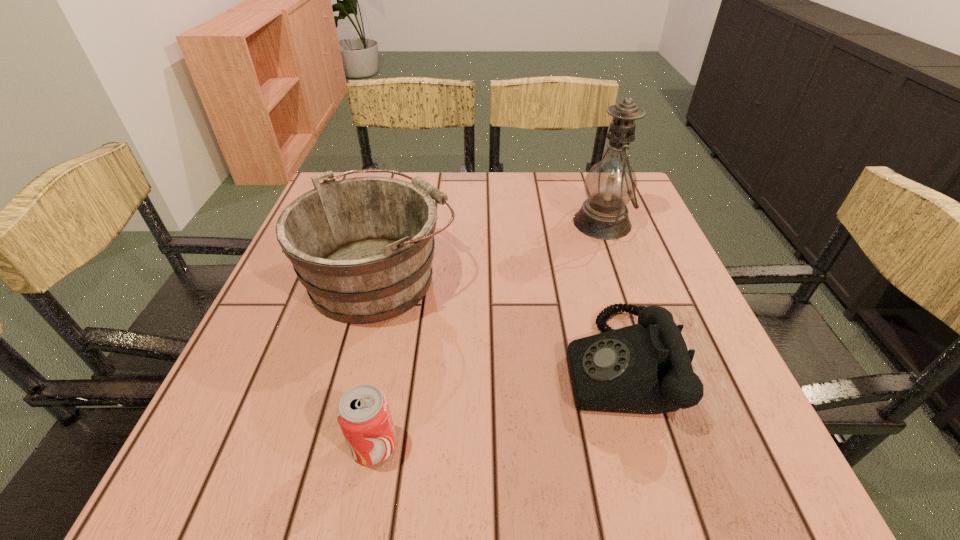
The image size is (960, 540). I want to click on vacant point located between the wine bucket and the oil lamp, so click(x=492, y=249).

Locate an element on the screen. free point between the second tallest object and the tallest object is located at coordinates (492, 249).

Locate an element on the screen. free space that is in between the wine bucket and the telephone is located at coordinates (498, 319).

The width and height of the screenshot is (960, 540). In order to click on free space between the wine bucket and the telephone in this screenshot , I will do `click(498, 319)`.

Where is `free spot between the tallest object and the wine bucket`? This screenshot has height=540, width=960. free spot between the tallest object and the wine bucket is located at coordinates (492, 249).

This screenshot has width=960, height=540. I want to click on free spot between the tallest object and the soda can, so [488, 334].

Where is `vacant region between the soda can and the telephone`? vacant region between the soda can and the telephone is located at coordinates (494, 404).

At what (x,y) coordinates should I click in order to perform the action: click on free area in between the wine bucket and the telephone. Please return your answer as a coordinate pair (x, y). This screenshot has width=960, height=540. Looking at the image, I should click on (498, 319).

Locate an element on the screen. vacant space that is in between the oil lamp and the telephone is located at coordinates (609, 293).

I want to click on vacant point located between the third shortest object and the soda can, so click(x=377, y=360).